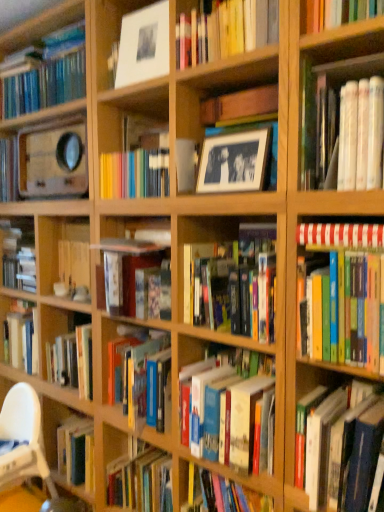
Question: In terms of height, does white paper book at upper right, acting as the 1th book starting from the top, look taller or shorter compared to hardcover book at right, the 6th book in the top-to-bottom sequence?

Choices:
 (A) tall
 (B) short

Answer: (B)

Question: From a real-world perspective, relative to hardcover book at right, placed as the first book when sorted from bottom to top, is white paper book at upper right, arranged as the sixth book when ordered from the bottom, vertically above or below?

Choices:
 (A) below
 (B) above

Answer: (B)

Question: Based on their relative distances, which object is nearer to the white paper book at upper right, acting as the 1th book starting from the top?

Choices:
 (A) white plastic chair at lower left
 (B) matte black frame at center, the second shelf in the top-to-bottom sequence
 (C) matte white frame at upper center, the 2th shelf when ordered from right to left
 (D) hardcover book at center, which appears as the 2th book when ordered from the bottom
 (E) hardcover books at right, the fourth book when ordered from top to bottom

Answer: (B)

Question: Estimate the real-world distances between objects in this image. Which object is closer to the white plastic chair at lower left?

Choices:
 (A) white paper book at upper right, arranged as the sixth book when ordered from the bottom
 (B) black matte picture frame at upper center
 (C) hardcover books at right, the fourth book when ordered from top to bottom
 (D) matte black frame at center, the second shelf in the top-to-bottom sequence
 (E) white striped book at right, the 2th book in the top-to-bottom sequence

Answer: (B)